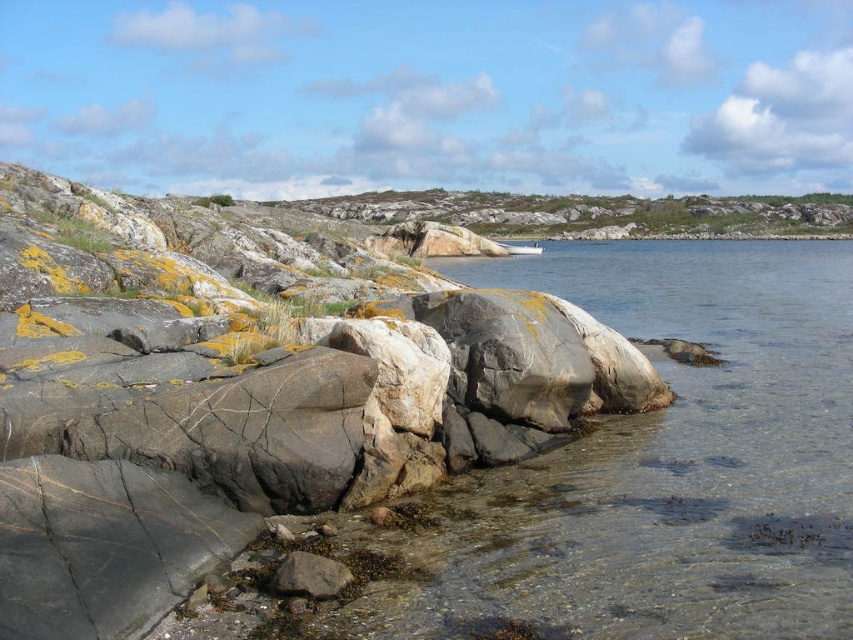
You are standing at the point marked as point (242, 394) in the image. What type of surface are you currently standing on?

You are standing on a gray rough rock at center.